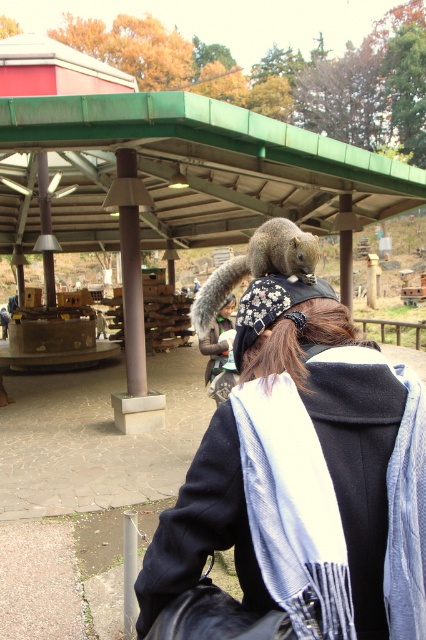
You are a photographer trying to capture the scene of the person and the squirrel. The black woolen scarf at upper center and the gray furry squirrel on the shoulder are both in your viewfinder. Which object is taller in the frame?

The gray furry squirrel on the shoulder is taller than the black woolen scarf at upper center according to the description.

You are a photographer trying to capture a closeup of the black woolen scarf at upper center and the gray furry squirrel on the shoulder in the same frame. Given that your camera can only focus on objects within a 50 cm range, will you be able to capture both subjects clearly?

The black woolen scarf at upper center and the gray furry squirrel on the shoulder are 57.98 centimeters apart, which exceeds the camera focus range of 50 cm. Therefore, you cannot capture both subjects clearly in the same frame.